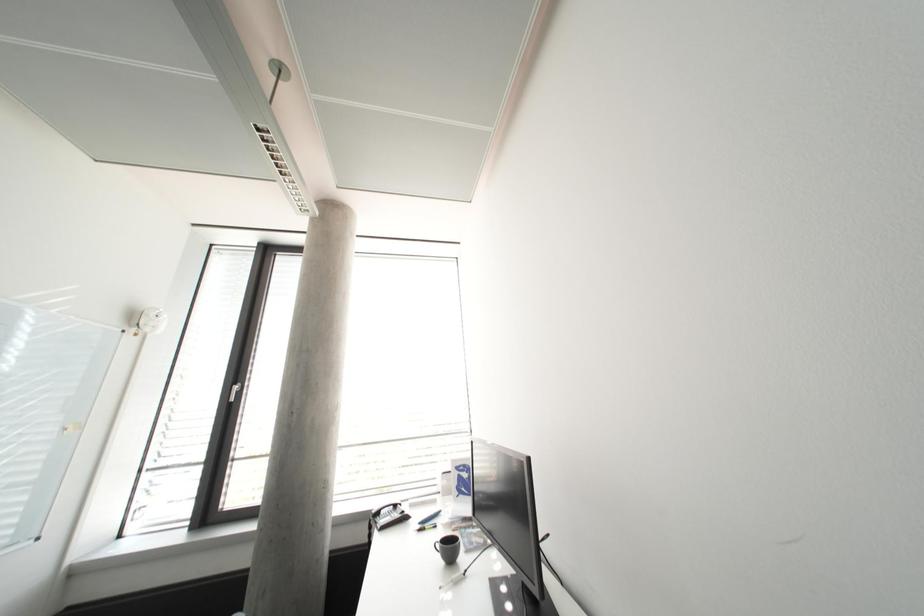
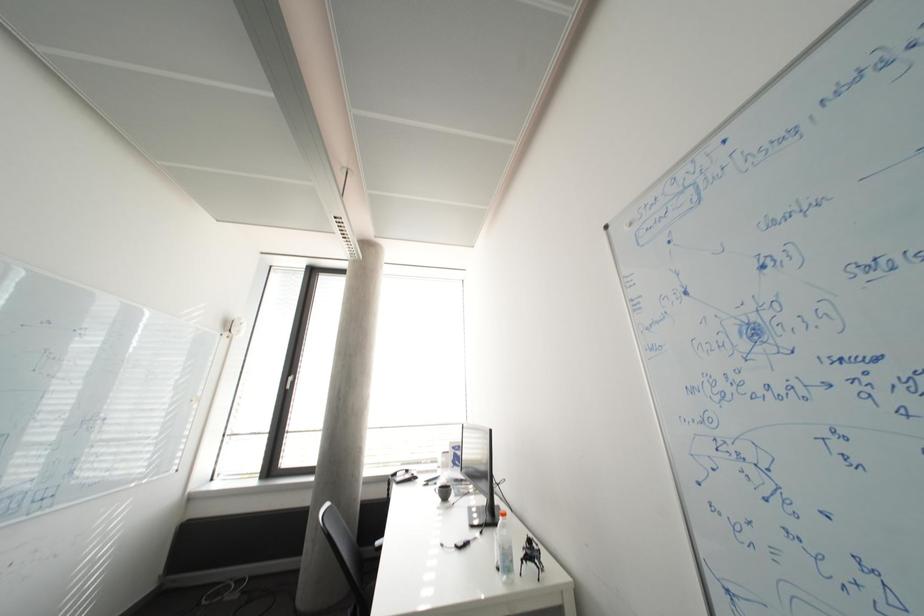
Question: The first image is from the beginning of the video and the second image is from the end. How did the camera likely rotate when shooting the video?

Choices:
 (A) Left
 (B) Right
 (C) Up
 (D) Down

Answer: (A)